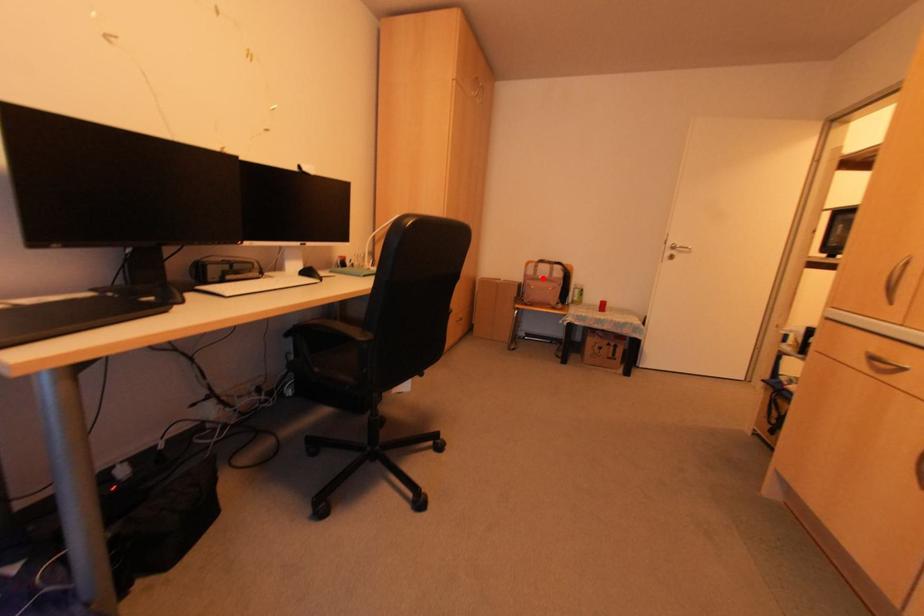
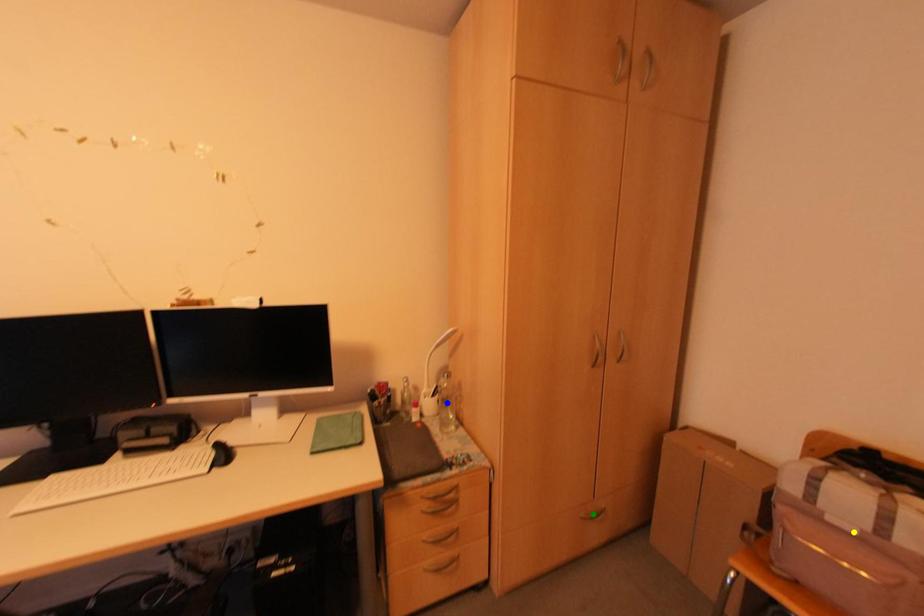
Question: I am providing you with two images of the same scene from different viewpoints. A red point is marked on the first image. You are given multiple points on the second image. Which mark in image 2 goes with the point in image 1?

Choices:
 (A) blue point
 (B) yellow point
 (C) green point

Answer: (B)